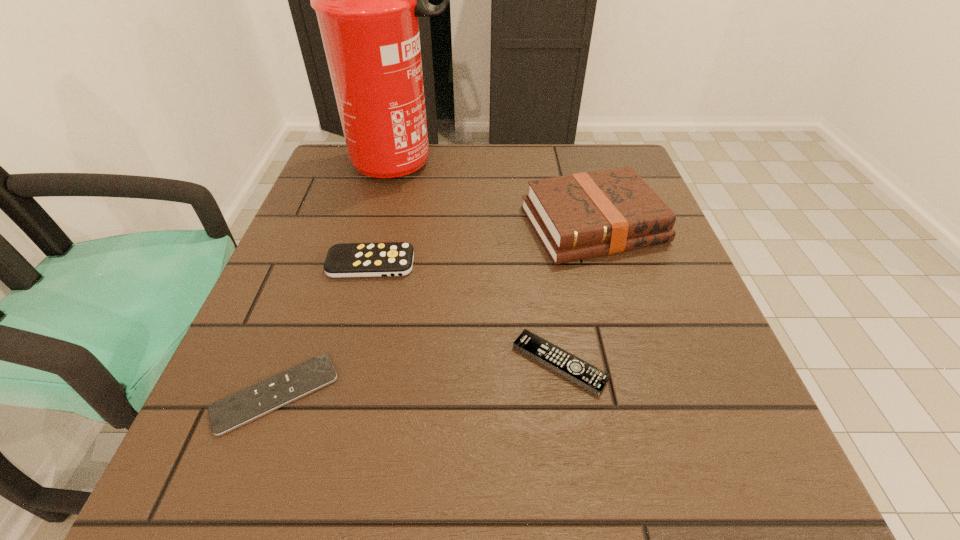
Find the location of `vacant point located between the second tallest remote control and the hardback book`. vacant point located between the second tallest remote control and the hardback book is located at coordinates (576, 294).

The height and width of the screenshot is (540, 960). Identify the location of free space between the fourth tallest object and the shortest remote control. (418, 379).

The width and height of the screenshot is (960, 540). I want to click on empty space between the tallest object and the third shortest object, so click(x=387, y=214).

You are a GUI agent. You are given a task and a screenshot of the screen. Output one action in this format:
    pyautogui.click(x=<x>, y=<y>)
    Task: Click on the vacant space that's between the farthest object and the shortest object
    The height and width of the screenshot is (540, 960).
    Given the screenshot: What is the action you would take?
    pyautogui.click(x=339, y=279)

Locate an element on the screen. Image resolution: width=960 pixels, height=540 pixels. vacant region between the shortest remote control and the fourth shortest object is located at coordinates (435, 309).

Identify which object is located as the second nearest to the shortest remote control. Please provide its 2D coordinates. Your answer should be formatted as a tuple, i.e. [(x, y)], where the tuple contains the x and y coordinates of a point satisfying the conditions above.

[(593, 379)]

Locate an element on the screen. The width and height of the screenshot is (960, 540). object that is the third closest to the second shortest object is located at coordinates (240, 408).

The height and width of the screenshot is (540, 960). I want to click on remote control that is the third closest to the hardback book, so click(x=240, y=408).

Find the location of a particular element. The width and height of the screenshot is (960, 540). remote control that is the nearest to the second tallest object is located at coordinates (593, 379).

You are a GUI agent. You are given a task and a screenshot of the screen. Output one action in this format:
    pyautogui.click(x=<x>, y=<y>)
    Task: Click on the vacant area in the image that satisfies the following two spatial constraints: 1. on the trigger side of the farthest object; 2. on the front side of the shortest object
    
    Given the screenshot: What is the action you would take?
    pyautogui.click(x=348, y=394)